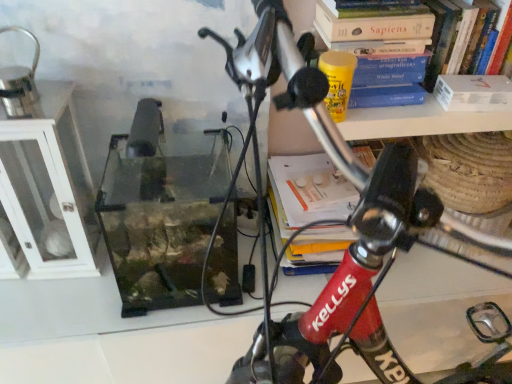
Question: Does hardcover book at upper right, positioned as the first book in right-to-left order, appear on the right side of red matte bicycle handlebar at center?

Choices:
 (A) yes
 (B) no

Answer: (A)

Question: Can you see hardcover book at upper right, positioned as the first book in right-to-left order, touching red matte bicycle handlebar at center?

Choices:
 (A) yes
 (B) no

Answer: (B)

Question: Is hardcover book at upper right, which is the second book in left-to-right order, thinner than red matte bicycle handlebar at center?

Choices:
 (A) yes
 (B) no

Answer: (A)

Question: From a real-world perspective, does hardcover book at upper right, positioned as the first book in right-to-left order, stand above red matte bicycle handlebar at center?

Choices:
 (A) yes
 (B) no

Answer: (A)

Question: Can you confirm if hardcover book at upper right, positioned as the first book in right-to-left order, is taller than red matte bicycle handlebar at center?

Choices:
 (A) no
 (B) yes

Answer: (A)

Question: From the image's perspective, is hardcover book at upper right, positioned as the first book in right-to-left order, below red matte bicycle handlebar at center?

Choices:
 (A) yes
 (B) no

Answer: (B)

Question: Would you consider hardcover book at upper right, positioned as the 2th book in right-to-left order, to be distant from hardcover book at upper right, which is the second book in left-to-right order?

Choices:
 (A) no
 (B) yes

Answer: (A)

Question: Can you confirm if hardcover book at upper right, which is the first book from left to right, is taller than hardcover book at upper right, which is the second book in left-to-right order?

Choices:
 (A) yes
 (B) no

Answer: (B)

Question: Is hardcover book at upper right, which is the first book from left to right, outside of hardcover book at upper right, positioned as the first book in right-to-left order?

Choices:
 (A) yes
 (B) no

Answer: (A)

Question: From a real-world perspective, is hardcover book at upper right, positioned as the 2th book in right-to-left order, physically above hardcover book at upper right, positioned as the first book in right-to-left order?

Choices:
 (A) no
 (B) yes

Answer: (A)

Question: From a real-world perspective, is hardcover book at upper right, positioned as the 2th book in right-to-left order, positioned under hardcover book at upper right, which is the second book in left-to-right order, based on gravity?

Choices:
 (A) no
 (B) yes

Answer: (B)

Question: Considering the relative sizes of hardcover book at upper right, positioned as the 2th book in right-to-left order, and hardcover book at upper right, which is the second book in left-to-right order, in the image provided, is hardcover book at upper right, positioned as the 2th book in right-to-left order, bigger than hardcover book at upper right, which is the second book in left-to-right order,?

Choices:
 (A) no
 (B) yes

Answer: (A)

Question: Would you say white glass cabinet at left is part of hardcover book at upper right, which is the second book in left-to-right order,'s contents?

Choices:
 (A) no
 (B) yes

Answer: (A)